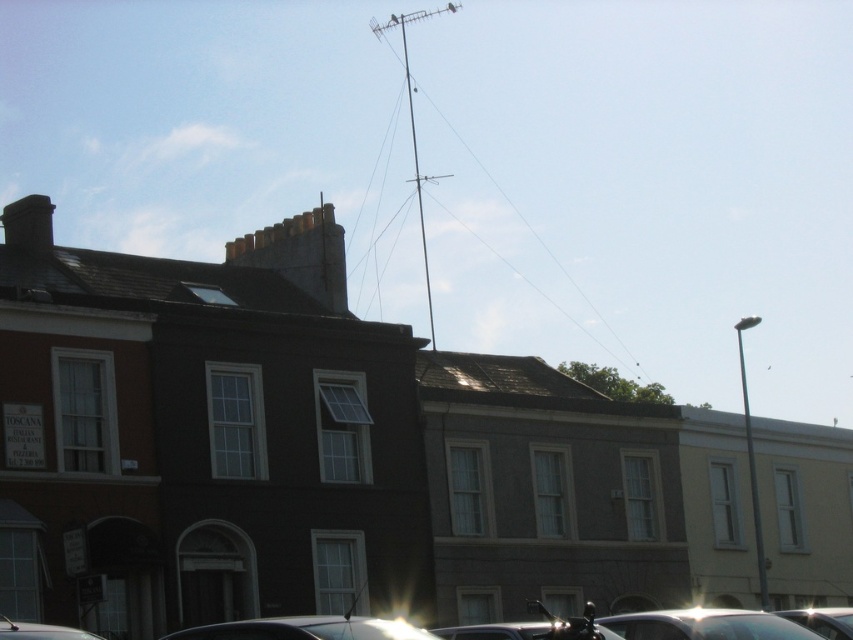
Question: Is shiny silver car at lower center to the left of shiny chrome motorcycle at lower center from the viewer's perspective?

Choices:
 (A) no
 (B) yes

Answer: (A)

Question: Which point is closer to the camera?

Choices:
 (A) metallic antenna at upper center
 (B) shiny silver car at lower center
 (C) metallic silver car at lower right

Answer: (B)

Question: Estimate the real-world distances between objects in this image. Which object is closer to the metallic silver car at lower left?

Choices:
 (A) metallic silver car at lower center
 (B) shiny chrome motorcycle at lower center
 (C) metallic silver car at lower right
 (D) shiny silver car at lower center

Answer: (A)

Question: Does metallic silver car at lower center lie behind metallic silver car at lower left?

Choices:
 (A) yes
 (B) no

Answer: (A)

Question: Which of the following is the farthest from the observer?

Choices:
 (A) metallic silver car at lower left
 (B) shiny silver car at lower center

Answer: (B)

Question: Considering the relative positions of shiny silver car at lower center and metallic silver car at lower right in the image provided, where is shiny silver car at lower center located with respect to metallic silver car at lower right?

Choices:
 (A) below
 (B) above

Answer: (B)